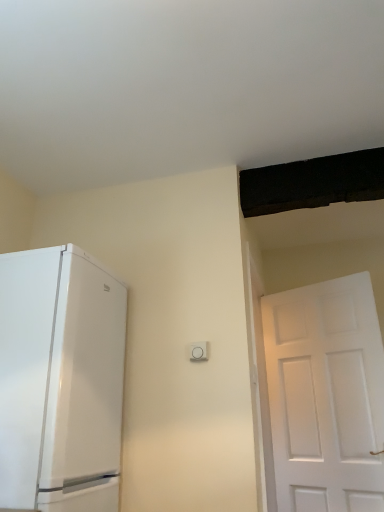
You are a GUI agent. You are given a task and a screenshot of the screen. Output one action in this format:
    pyautogui.click(x=<x>, y=<y>)
    Task: Click on the white glossy refrigerator at left
    This screenshot has width=384, height=512.
    Given the screenshot: What is the action you would take?
    pyautogui.click(x=60, y=381)

The width and height of the screenshot is (384, 512). Describe the element at coordinates (60, 381) in the screenshot. I see `white glossy refrigerator at left` at that location.

Image resolution: width=384 pixels, height=512 pixels. What do you see at coordinates (199, 351) in the screenshot?
I see `white plastic light switch at center` at bounding box center [199, 351].

Identify the location of white plastic light switch at center. (199, 351).

You are a GUI agent. You are given a task and a screenshot of the screen. Output one action in this format:
    pyautogui.click(x=<x>, y=<y>)
    Task: Click on the white glossy refrigerator at left
    Image resolution: width=384 pixels, height=512 pixels.
    Given the screenshot: What is the action you would take?
    pyautogui.click(x=60, y=381)

Is white plastic light switch at center to the left of white glossy refrigerator at left from the viewer's perspective?

Incorrect, white plastic light switch at center is not on the left side of white glossy refrigerator at left.

Is white plastic light switch at center closer to camera compared to white glossy refrigerator at left?

No, the depth of white plastic light switch at center is greater than that of white glossy refrigerator at left.

Is point (207, 344) closer or farther from the camera than point (50, 400)?

Point (207, 344).

From the image's perspective, relative to white glossy refrigerator at left, is white plastic light switch at center above or below?

Clearly, from the image's perspective, white plastic light switch at center is above white glossy refrigerator at left.

From a real-world perspective, is white plastic light switch at center positioned above or below white glossy refrigerator at left?

From a real-world perspective, white plastic light switch at center is physically above white glossy refrigerator at left.

Between white plastic light switch at center and white glossy refrigerator at left, which one has smaller width?

white plastic light switch at center is thinner.

Which of these two, white plastic light switch at center or white glossy refrigerator at left, stands taller?

With more height is white glossy refrigerator at left.

Considering the relative sizes of white plastic light switch at center and white glossy refrigerator at left in the image provided, is white plastic light switch at center smaller than white glossy refrigerator at left?

Yes, white plastic light switch at center is smaller than white glossy refrigerator at left.

Is white glossy refrigerator at left located within white plastic light switch at center?

Actually, white glossy refrigerator at left is outside white plastic light switch at center.

Is white plastic light switch at center not close to white glossy refrigerator at left?

No, there isn't a large distance between white plastic light switch at center and white glossy refrigerator at left.

Does white plastic light switch at center turn towards white glossy refrigerator at left?

No, white plastic light switch at center is not facing towards white glossy refrigerator at left.

Locate an element on the screen. light switch above the white glossy refrigerator at left (from the image's perspective) is located at coordinates (199, 351).

Can you confirm if white glossy refrigerator at left is positioned to the left of white plastic light switch at center?

Correct, you'll find white glossy refrigerator at left to the left of white plastic light switch at center.

Considering the positions of objects white glossy refrigerator at left and white plastic light switch at center in the image provided, who is behind, white glossy refrigerator at left or white plastic light switch at center?

white plastic light switch at center is further from the camera.

Which point is more distant from viewer, (106, 494) or (203, 342)?

The point (203, 342) is behind.

From the image's perspective, who appears lower, white glossy refrigerator at left or white plastic light switch at center?

white glossy refrigerator at left.

From a real-world perspective, which is physically above, white glossy refrigerator at left or white plastic light switch at center?

In real-world perspective, white plastic light switch at center is above.

Which of these two, white glossy refrigerator at left or white plastic light switch at center, is wider?

white glossy refrigerator at left.

Is white glossy refrigerator at left taller than white plastic light switch at center?

Correct, white glossy refrigerator at left is much taller as white plastic light switch at center.

Considering the sizes of objects white glossy refrigerator at left and white plastic light switch at center in the image provided, who is smaller, white glossy refrigerator at left or white plastic light switch at center?

white plastic light switch at center.

Can we say white glossy refrigerator at left lies outside white plastic light switch at center?

Yes, white glossy refrigerator at left is not within white plastic light switch at center.

Is white glossy refrigerator at left next to white plastic light switch at center and touching it?

They are not placed beside each other.

Is white glossy refrigerator at left facing away from white plastic light switch at center?

That's not correct — white glossy refrigerator at left is not looking away from white plastic light switch at center.

Where is `light switch lying behind the white glossy refrigerator at left`? Image resolution: width=384 pixels, height=512 pixels. light switch lying behind the white glossy refrigerator at left is located at coordinates (199, 351).

Where is `light switch that is behind the white glossy refrigerator at left`? This screenshot has height=512, width=384. light switch that is behind the white glossy refrigerator at left is located at coordinates (199, 351).

Locate an element on the screen. light switch on the right of white glossy refrigerator at left is located at coordinates (199, 351).